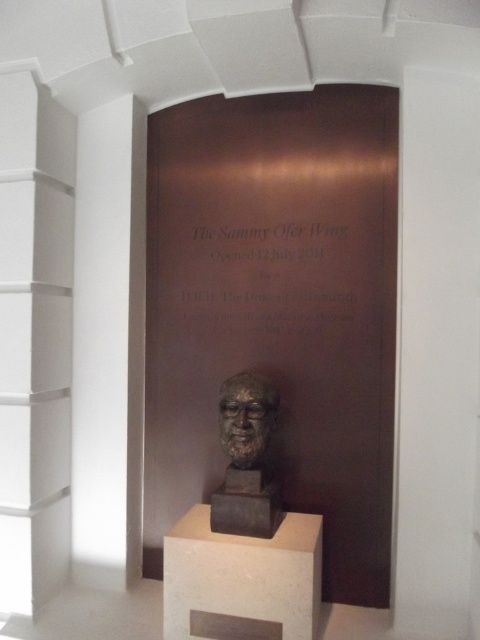
Measure the distance between point (296, 548) and camera.

A distance of 5.56 feet exists between point (296, 548) and camera.

Is point (274, 561) positioned in front of point (263, 259)?

Yes, point (274, 561) is closer to viewer.

Where is `white marble pedestal at center`? The image size is (480, 640). white marble pedestal at center is located at coordinates (241, 580).

Is bronze plaque at center above bronze sculpture at center?

Correct, bronze plaque at center is located above bronze sculpture at center.

Can you confirm if bronze plaque at center is positioned below bronze sculpture at center?

Actually, bronze plaque at center is above bronze sculpture at center.

The image size is (480, 640). What are the coordinates of `bronze plaque at center` in the screenshot? It's located at (271, 275).

Does bronze bust at center appear on the left side of bronze/statue at center?

Correct, you'll find bronze bust at center to the left of bronze/statue at center.

Is bronze bust at center below bronze/statue at center?

Indeed, bronze bust at center is positioned under bronze/statue at center.

Is point (238, 476) positioned in front of point (214, 515)?

No, it is not.

This screenshot has height=640, width=480. I want to click on bronze bust at center, so click(x=242, y=540).